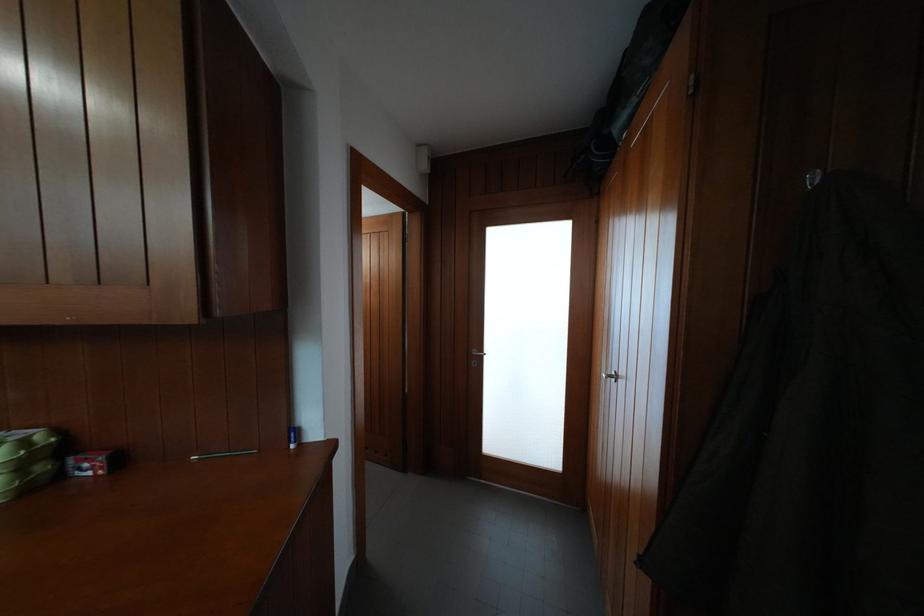
Where would you pull the silver cabinet handle? Please return your answer as a coordinate pair (x, y).

(605, 375)